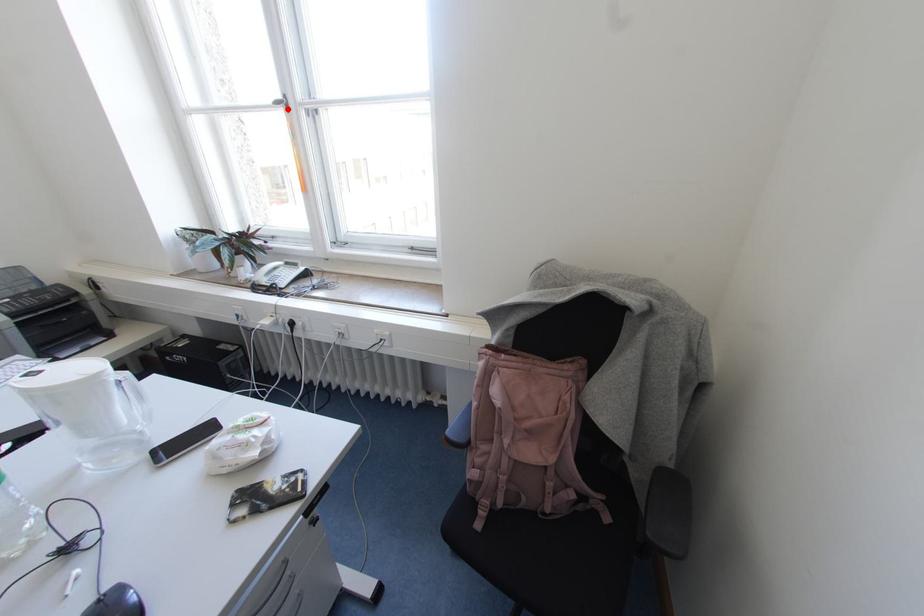
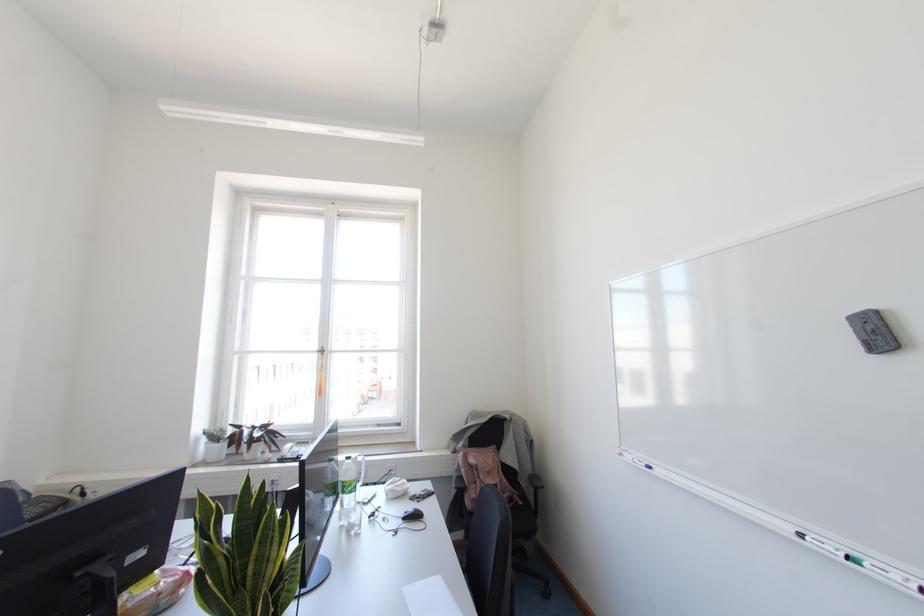
Locate, in the second image, the point that corresponds to the highlighted location in the first image.

(322, 353)